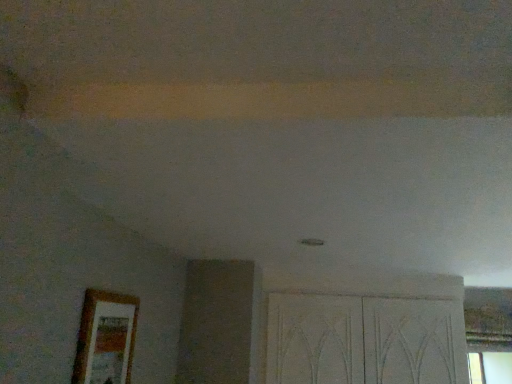
Question: Is wooden picture frame at lower left spatially inside white textured screen door at lower right, or outside of it?

Choices:
 (A) outside
 (B) inside

Answer: (A)

Question: From the image's perspective, relative to white textured screen door at lower right, is wooden picture frame at lower left above or below?

Choices:
 (A) above
 (B) below

Answer: (A)

Question: Based on their sizes in the image, would you say wooden picture frame at lower left is bigger or smaller than white textured screen door at lower right?

Choices:
 (A) big
 (B) small

Answer: (B)

Question: In the image, is white textured screen door at lower right on the left side or the right side of wooden picture frame at lower left?

Choices:
 (A) right
 (B) left

Answer: (A)

Question: From the image's perspective, is white textured screen door at lower right located above or below wooden picture frame at lower left?

Choices:
 (A) above
 (B) below

Answer: (B)

Question: From their relative heights in the image, would you say white textured screen door at lower right is taller or shorter than wooden picture frame at lower left?

Choices:
 (A) tall
 (B) short

Answer: (A)

Question: Is white textured screen door at lower right in front of or behind wooden picture frame at lower left in the image?

Choices:
 (A) behind
 (B) front

Answer: (A)